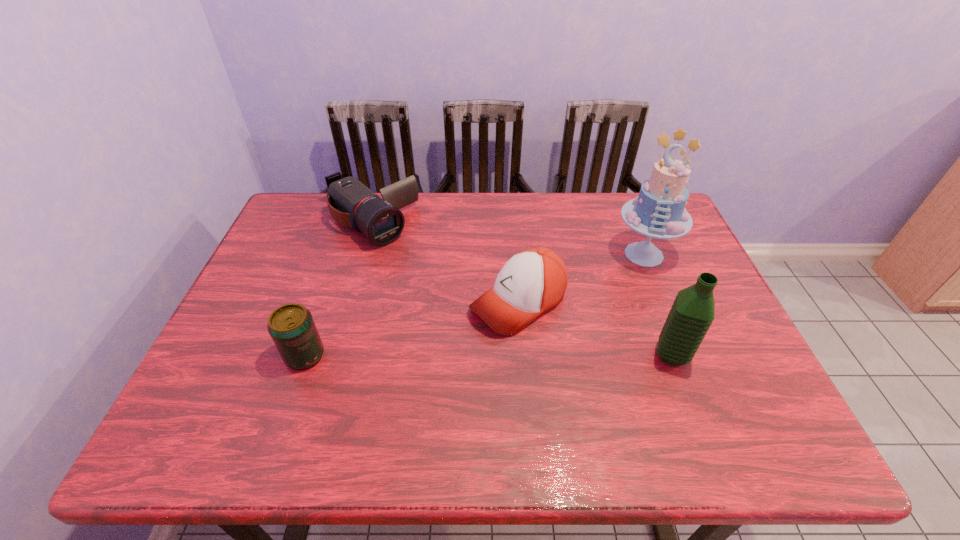
What are the coordinates of `free space located on the lens of the camcorder` in the screenshot? It's located at (463, 304).

The width and height of the screenshot is (960, 540). Identify the location of vacant space located 0.110m on the lens of the camcorder. (417, 264).

Locate an element on the screen. This screenshot has height=540, width=960. free space located on the lens of the camcorder is located at coordinates (433, 278).

Locate an element on the screen. Image resolution: width=960 pixels, height=540 pixels. vacant region located 0.360m with a ladder on the side of the cake is located at coordinates (538, 333).

The width and height of the screenshot is (960, 540). I want to click on vacant area situated 0.360m with a ladder on the side of the cake, so tap(538, 333).

What are the coordinates of `vacant space located 0.210m with a ladder on the side of the cake` in the screenshot? It's located at click(577, 304).

You are a GUI agent. You are given a task and a screenshot of the screen. Output one action in this format:
    pyautogui.click(x=<x>, y=<y>)
    Task: Click on the camcorder that is at the far edge
    
    Given the screenshot: What is the action you would take?
    pyautogui.click(x=351, y=203)

Identify the location of cake located at the far edge. The image size is (960, 540). pos(659,212).

Identify the location of object at the left edge. The width and height of the screenshot is (960, 540). (351, 203).

At what (x,y) coordinates should I click in order to perform the action: click on water bottle situated at the right edge. Please return your answer as a coordinate pair (x, y). Image resolution: width=960 pixels, height=540 pixels. Looking at the image, I should click on (692, 313).